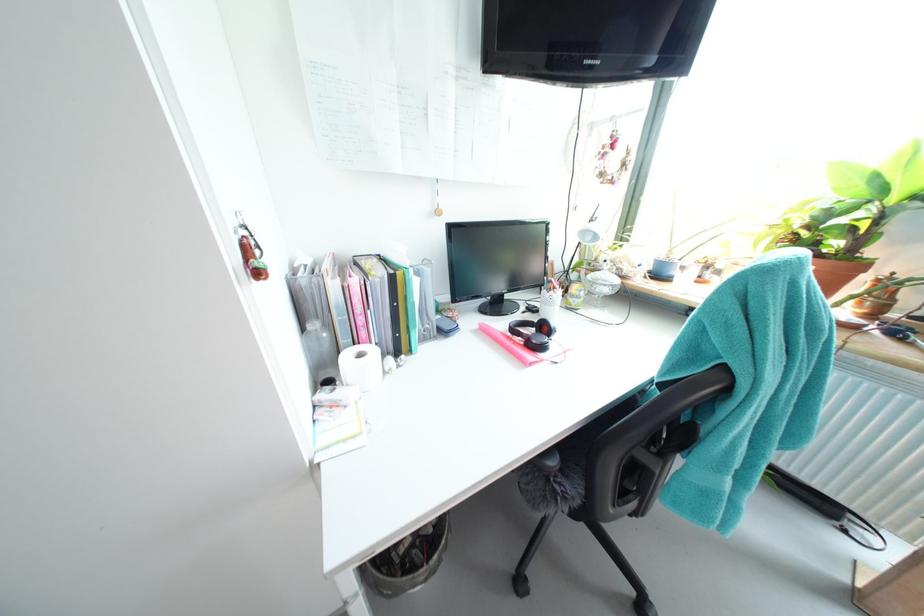
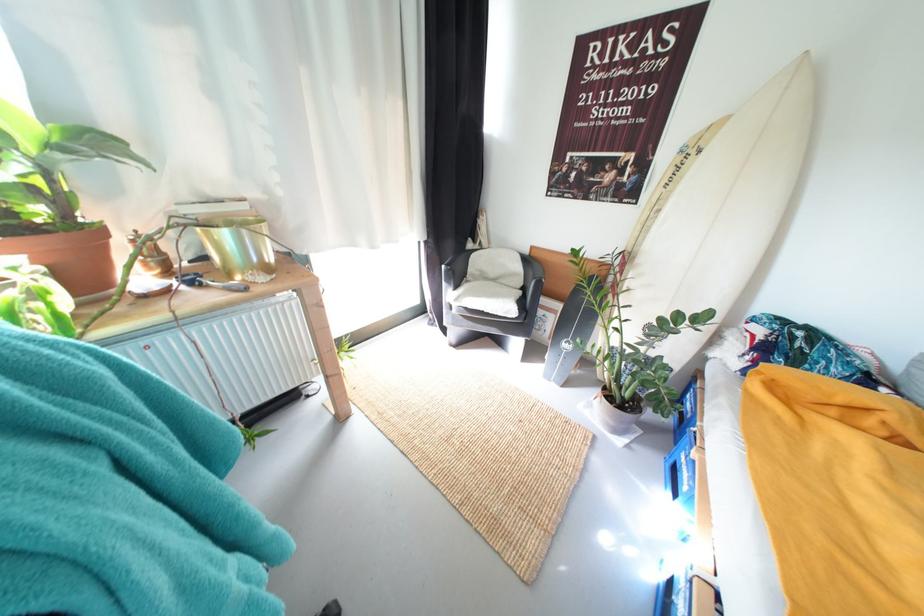
The images are taken continuously from a first-person perspective. In which direction is your viewpoint rotating?

The camera's rotation is toward right-down.